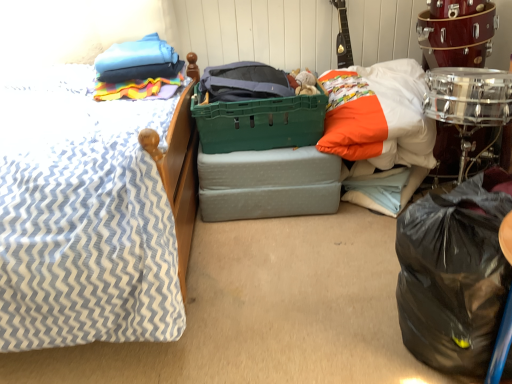
What are the coordinates of `free space in front of green plastic storage box at center` in the screenshot? It's located at (275, 256).